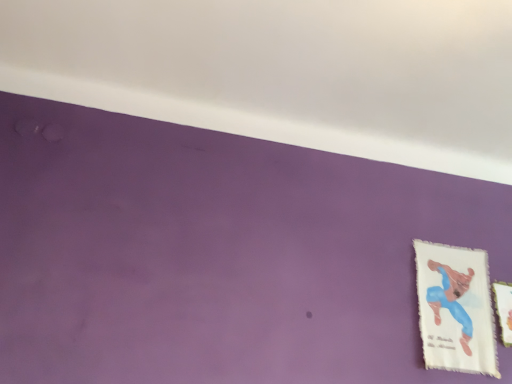
Identify the location of white fabric picture frame at right, the 1th picture frame when ordered from right to left. This screenshot has width=512, height=384. (504, 309).

The height and width of the screenshot is (384, 512). Describe the element at coordinates (504, 309) in the screenshot. I see `white fabric picture frame at right, the 1th picture frame when ordered from right to left` at that location.

What do you see at coordinates (455, 308) in the screenshot? I see `white fabric picture frame at lower right, acting as the first picture frame starting from the left` at bounding box center [455, 308].

Image resolution: width=512 pixels, height=384 pixels. I want to click on white fabric picture frame at lower right, acting as the first picture frame starting from the left, so click(x=455, y=308).

Where is `white fabric picture frame at right, placed as the second picture frame when sorted from left to right`? Image resolution: width=512 pixels, height=384 pixels. white fabric picture frame at right, placed as the second picture frame when sorted from left to right is located at coordinates (504, 309).

Is white fabric picture frame at right, placed as the second picture frame when sorted from left to right, to the right of white fabric picture frame at lower right, acting as the first picture frame starting from the left, from the viewer's perspective?

Yes.

Is white fabric picture frame at right, placed as the second picture frame when sorted from left to right, closer to camera compared to white fabric picture frame at lower right, which is the second picture frame in right-to-left order?

That is False.

Looking at this image, which point is more forward, [504,340] or [465,323]?

The point [504,340] is more forward.

From the image's perspective, which object appears higher, white fabric picture frame at right, the 1th picture frame when ordered from right to left, or white fabric picture frame at lower right, acting as the first picture frame starting from the left?

From the image's view, white fabric picture frame at lower right, acting as the first picture frame starting from the left, is above.

From a real-world perspective, does white fabric picture frame at right, the 1th picture frame when ordered from right to left, stand above white fabric picture frame at lower right, which is the second picture frame in right-to-left order?

Yes, from a real-world perspective, white fabric picture frame at right, the 1th picture frame when ordered from right to left, is on top of white fabric picture frame at lower right, which is the second picture frame in right-to-left order.

Is white fabric picture frame at right, placed as the second picture frame when sorted from left to right, wider or thinner than white fabric picture frame at lower right, which is the second picture frame in right-to-left order?

Considering their sizes, white fabric picture frame at right, placed as the second picture frame when sorted from left to right, looks slimmer than white fabric picture frame at lower right, which is the second picture frame in right-to-left order.

Does white fabric picture frame at right, the 1th picture frame when ordered from right to left, have a greater height compared to white fabric picture frame at lower right, which is the second picture frame in right-to-left order?

No.

Is white fabric picture frame at right, placed as the second picture frame when sorted from left to right, bigger than white fabric picture frame at lower right, acting as the first picture frame starting from the left?

Incorrect, white fabric picture frame at right, placed as the second picture frame when sorted from left to right, is not larger than white fabric picture frame at lower right, acting as the first picture frame starting from the left.

Is white fabric picture frame at right, the 1th picture frame when ordered from right to left, positioned beyond the bounds of white fabric picture frame at lower right, acting as the first picture frame starting from the left?

Yes, white fabric picture frame at right, the 1th picture frame when ordered from right to left, is outside of white fabric picture frame at lower right, acting as the first picture frame starting from the left.

Is white fabric picture frame at right, placed as the second picture frame when sorted from left to right, with white fabric picture frame at lower right, acting as the first picture frame starting from the left?

white fabric picture frame at right, placed as the second picture frame when sorted from left to right, and white fabric picture frame at lower right, acting as the first picture frame starting from the left, are not in contact.

Is white fabric picture frame at right, placed as the second picture frame when sorted from left to right, positioned with its back to white fabric picture frame at lower right, which is the second picture frame in right-to-left order?

white fabric picture frame at right, placed as the second picture frame when sorted from left to right, does not have its back to white fabric picture frame at lower right, which is the second picture frame in right-to-left order.

Where is `picture frame on the right of white fabric picture frame at lower right, which is the second picture frame in right-to-left order`? This screenshot has width=512, height=384. picture frame on the right of white fabric picture frame at lower right, which is the second picture frame in right-to-left order is located at coordinates (504, 309).

Considering the relative positions of white fabric picture frame at lower right, acting as the first picture frame starting from the left, and white fabric picture frame at right, the 1th picture frame when ordered from right to left, in the image provided, is white fabric picture frame at lower right, acting as the first picture frame starting from the left, to the left of white fabric picture frame at right, the 1th picture frame when ordered from right to left, from the viewer's perspective?

Correct, you'll find white fabric picture frame at lower right, acting as the first picture frame starting from the left, to the left of white fabric picture frame at right, the 1th picture frame when ordered from right to left.

Considering the positions of objects white fabric picture frame at lower right, which is the second picture frame in right-to-left order, and white fabric picture frame at right, the 1th picture frame when ordered from right to left, in the image provided, who is behind, white fabric picture frame at lower right, which is the second picture frame in right-to-left order, or white fabric picture frame at right, the 1th picture frame when ordered from right to left,?

white fabric picture frame at right, the 1th picture frame when ordered from right to left.

Considering the points (465, 353) and (505, 283), which point is in front, point (465, 353) or point (505, 283)?

Point (465, 353)

From the image's perspective, would you say white fabric picture frame at lower right, acting as the first picture frame starting from the left, is positioned over white fabric picture frame at right, placed as the second picture frame when sorted from left to right?

Indeed, from the image's perspective, white fabric picture frame at lower right, acting as the first picture frame starting from the left, is shown above white fabric picture frame at right, placed as the second picture frame when sorted from left to right.

From a real-world perspective, is white fabric picture frame at lower right, which is the second picture frame in right-to-left order, under white fabric picture frame at right, the 1th picture frame when ordered from right to left?

Yes.

Is white fabric picture frame at lower right, acting as the first picture frame starting from the left, thinner than white fabric picture frame at right, the 1th picture frame when ordered from right to left?

Incorrect, the width of white fabric picture frame at lower right, acting as the first picture frame starting from the left, is not less than that of white fabric picture frame at right, the 1th picture frame when ordered from right to left.

Who is taller, white fabric picture frame at lower right, which is the second picture frame in right-to-left order, or white fabric picture frame at right, the 1th picture frame when ordered from right to left?

white fabric picture frame at lower right, which is the second picture frame in right-to-left order, is taller.

Looking at the image, does white fabric picture frame at lower right, which is the second picture frame in right-to-left order, seem bigger or smaller compared to white fabric picture frame at right, placed as the second picture frame when sorted from left to right?

Considering their sizes, white fabric picture frame at lower right, which is the second picture frame in right-to-left order, takes up more space than white fabric picture frame at right, placed as the second picture frame when sorted from left to right.

In the scene shown: Choose the correct answer: Is white fabric picture frame at lower right, acting as the first picture frame starting from the left, inside white fabric picture frame at right, placed as the second picture frame when sorted from left to right, or outside it?

white fabric picture frame at lower right, acting as the first picture frame starting from the left, is outside white fabric picture frame at right, placed as the second picture frame when sorted from left to right.

Is white fabric picture frame at lower right, acting as the first picture frame starting from the left, not near white fabric picture frame at right, placed as the second picture frame when sorted from left to right?

No, white fabric picture frame at lower right, acting as the first picture frame starting from the left, is not far from white fabric picture frame at right, placed as the second picture frame when sorted from left to right.

Does white fabric picture frame at lower right, which is the second picture frame in right-to-left order, turn towards white fabric picture frame at right, placed as the second picture frame when sorted from left to right?

No, white fabric picture frame at lower right, which is the second picture frame in right-to-left order, is not turned towards white fabric picture frame at right, placed as the second picture frame when sorted from left to right.

At what (x,y) coordinates should I click in order to perform the action: click on picture frame on the right of white fabric picture frame at lower right, which is the second picture frame in right-to-left order. Please return your answer as a coordinate pair (x, y). Looking at the image, I should click on (504, 309).

Identify the location of picture frame on the right side of white fabric picture frame at lower right, which is the second picture frame in right-to-left order. Image resolution: width=512 pixels, height=384 pixels. (504, 309).

The height and width of the screenshot is (384, 512). What are the coordinates of `picture frame that appears above the white fabric picture frame at right, placed as the second picture frame when sorted from left to right (from the image's perspective)` in the screenshot? It's located at (455, 308).